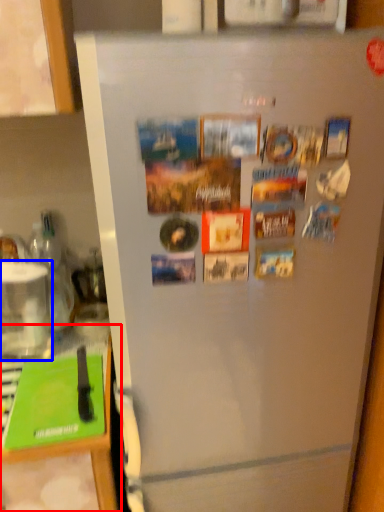
Question: Which of the following is the closest to the observer, counter top (highlighted by a red box) or appliance (highlighted by a blue box)?

Choices:
 (A) counter top
 (B) appliance

Answer: (A)